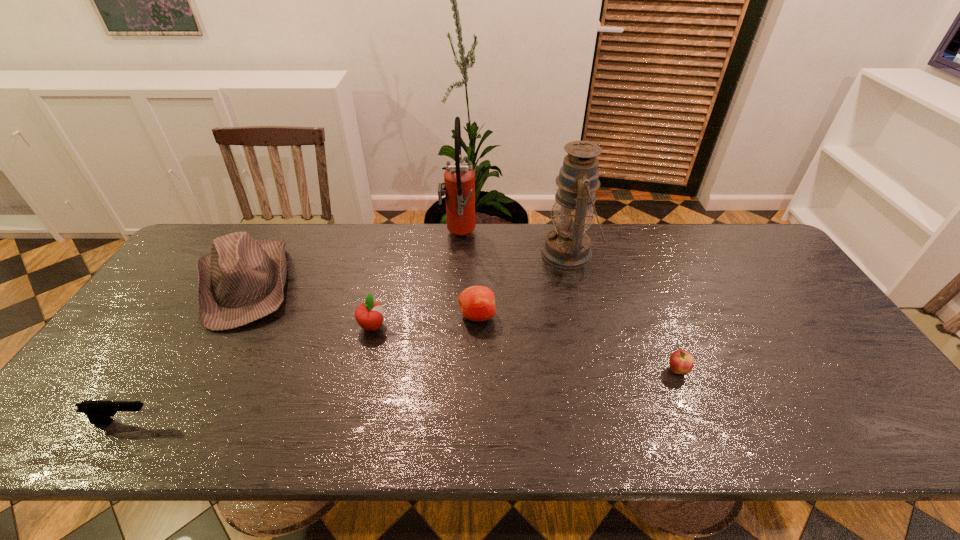
Where is `free space located on the right of the fedora`? The image size is (960, 540). free space located on the right of the fedora is located at coordinates (339, 284).

Find the location of a particular element. vacant area situated 0.150m on the front of the second apple from right to left is located at coordinates (476, 375).

This screenshot has width=960, height=540. Find the location of `vacant space located on the right of the leftmost apple`. vacant space located on the right of the leftmost apple is located at coordinates (497, 327).

The image size is (960, 540). Identify the location of vacant area located on the front-facing side of the pistol. (285, 422).

Identify the location of vacant space located on the left of the second nearest object. Image resolution: width=960 pixels, height=540 pixels. (638, 370).

The width and height of the screenshot is (960, 540). What are the coordinates of `fire extinguisher that is at the far edge` in the screenshot? It's located at (459, 178).

Identify the location of oil lamp present at the far edge. (567, 246).

Identify the location of fedora located in the far edge section of the desktop. (242, 280).

Image resolution: width=960 pixels, height=540 pixels. Identify the location of object located in the near edge section of the desktop. (98, 412).

Identify the location of fedora located in the left edge section of the desktop. (242, 280).